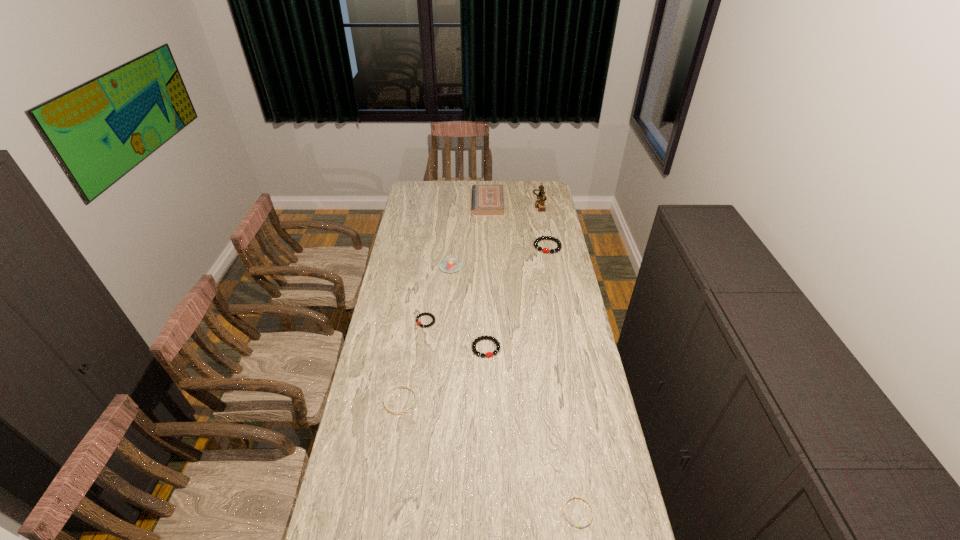
The height and width of the screenshot is (540, 960). In order to click on telephone that is at the right edge in this screenshot , I will do `click(540, 204)`.

Find the location of `object that is at the far right corner`. object that is at the far right corner is located at coordinates (540, 204).

The image size is (960, 540). In the image, there is a desktop. What are the coordinates of `free space at the left edge` in the screenshot? It's located at (410, 208).

This screenshot has height=540, width=960. I want to click on vacant area at the right edge of the desktop, so (587, 450).

At what (x,y) coordinates should I click in order to perform the action: click on vacant region at the far left corner of the desktop. Please return your answer as a coordinate pair (x, y). Looking at the image, I should click on (407, 196).

Image resolution: width=960 pixels, height=540 pixels. What are the coordinates of `free space between the sixth shortest object and the telephone` in the screenshot? It's located at (494, 234).

The width and height of the screenshot is (960, 540). Find the location of `free spot between the second nearest object and the Bible`. free spot between the second nearest object and the Bible is located at coordinates (444, 302).

The width and height of the screenshot is (960, 540). Identify the location of vacant area that lies between the third bracelet from right to left and the fourth nearest bracelet. (456, 334).

Where is `empty space that is in between the second nearest bracelet and the tallest object`? This screenshot has height=540, width=960. empty space that is in between the second nearest bracelet and the tallest object is located at coordinates (469, 301).

In order to click on vacant area that lies between the smallest black bracelet and the farthest black bracelet in this screenshot , I will do `click(487, 284)`.